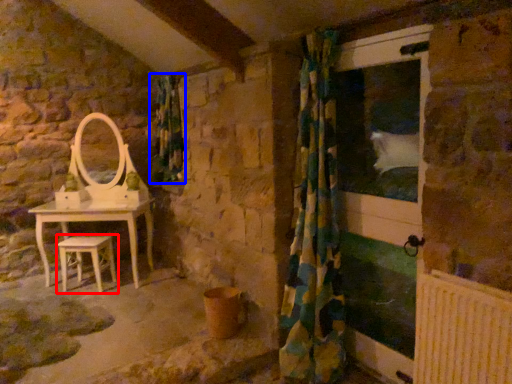
Question: Which point is further to the camera, stool (highlighted by a red box) or shower curtain (highlighted by a blue box)?

Choices:
 (A) stool
 (B) shower curtain

Answer: (B)